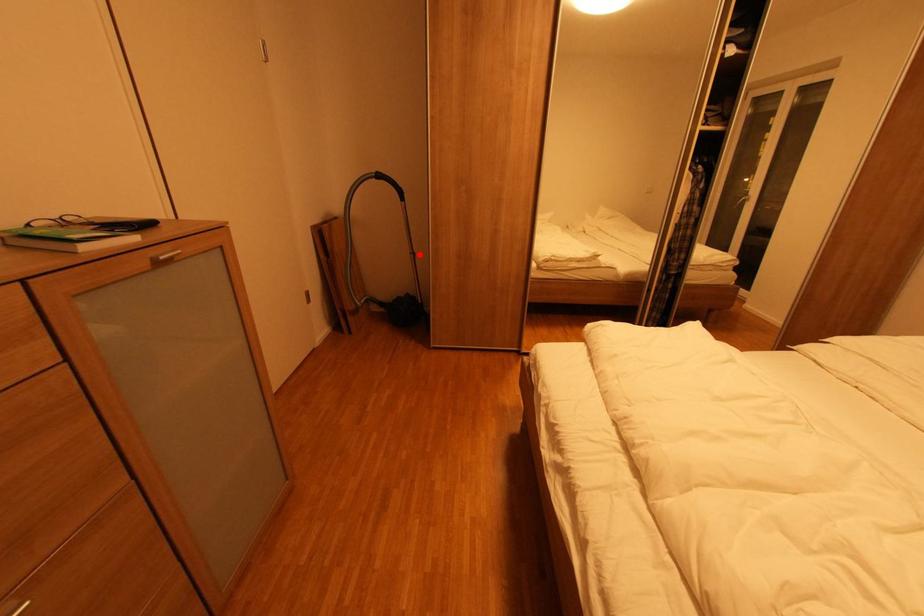
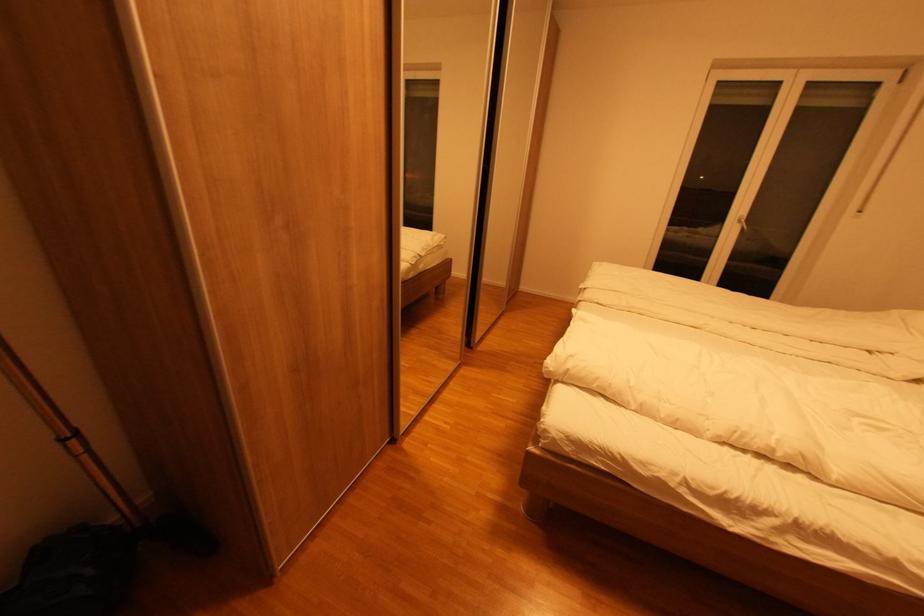
Question: I am providing you with two images of the same scene from different viewpoints. A red point is shown in image1. For the corresponding object point in image2, is it positioned nearer or farther from the camera?

Choices:
 (A) Nearer
 (B) Farther

Answer: (B)